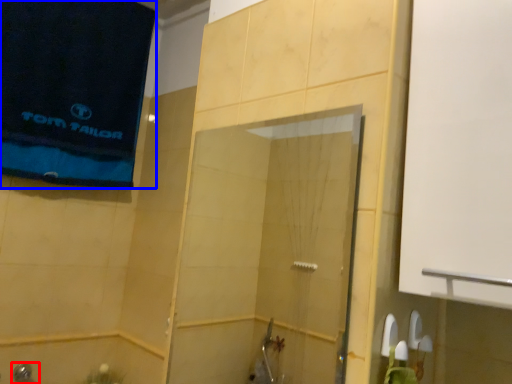
Question: Which point is further to the camera, shower (highlighted by a red box) or beach towel (highlighted by a blue box)?

Choices:
 (A) shower
 (B) beach towel

Answer: (A)